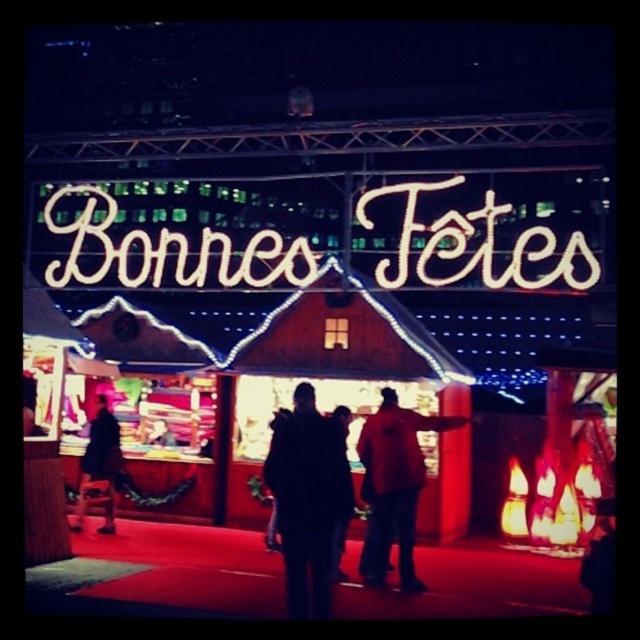
Question: Which point appears farthest from the camera in this image?

Choices:
 (A) (109, 424)
 (B) (400, 554)
 (C) (301, 564)

Answer: (A)

Question: Observing the image, what is the correct spatial positioning of dark fabric jacket at center in reference to dark blue jacket at left?

Choices:
 (A) below
 (B) above

Answer: (B)

Question: Can you confirm if red matte jacket at center is wider than dark blue jacket at left?

Choices:
 (A) yes
 (B) no

Answer: (A)

Question: Can you confirm if dark fabric jacket at center is positioned above dark blue jacket at left?

Choices:
 (A) no
 (B) yes

Answer: (B)

Question: Which object is positioned closest to the dark fabric jacket at center?

Choices:
 (A) red matte jacket at center
 (B) dark blue jacket at left

Answer: (A)

Question: Which object appears closest to the camera in this image?

Choices:
 (A) red matte jacket at center
 (B) dark fabric jacket at center
 (C) dark blue jacket at left

Answer: (B)